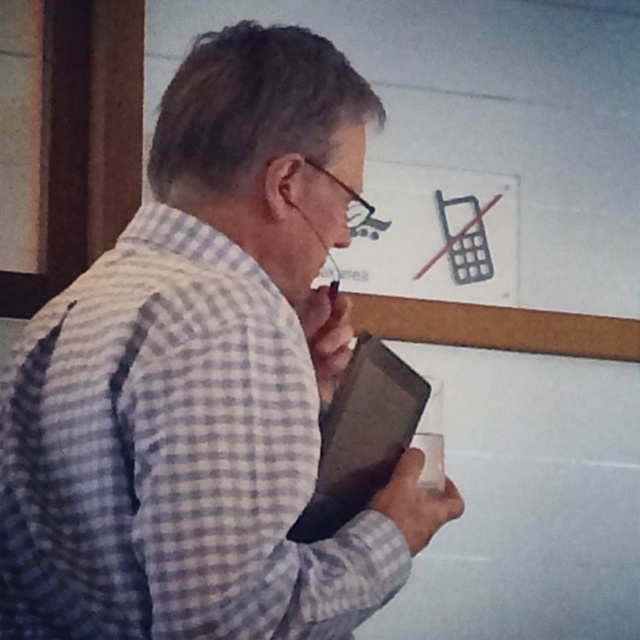
Question: Which of the following is the closest to the observer?

Choices:
 (A) (211, 595)
 (B) (525, 342)

Answer: (A)

Question: Can you confirm if checkered fabric shirt at center is positioned to the right of white matte bulletin board at upper center?

Choices:
 (A) no
 (B) yes

Answer: (A)

Question: Can you confirm if checkered fabric shirt at center is positioned below white matte bulletin board at upper center?

Choices:
 (A) yes
 (B) no

Answer: (A)

Question: Is checkered fabric shirt at center wider than white matte bulletin board at upper center?

Choices:
 (A) yes
 (B) no

Answer: (B)

Question: Which object is closer to the camera taking this photo?

Choices:
 (A) checkered fabric shirt at center
 (B) white matte bulletin board at upper center

Answer: (A)

Question: Which point is farther to the camera?

Choices:
 (A) white matte bulletin board at upper center
 (B) checkered fabric shirt at center

Answer: (A)